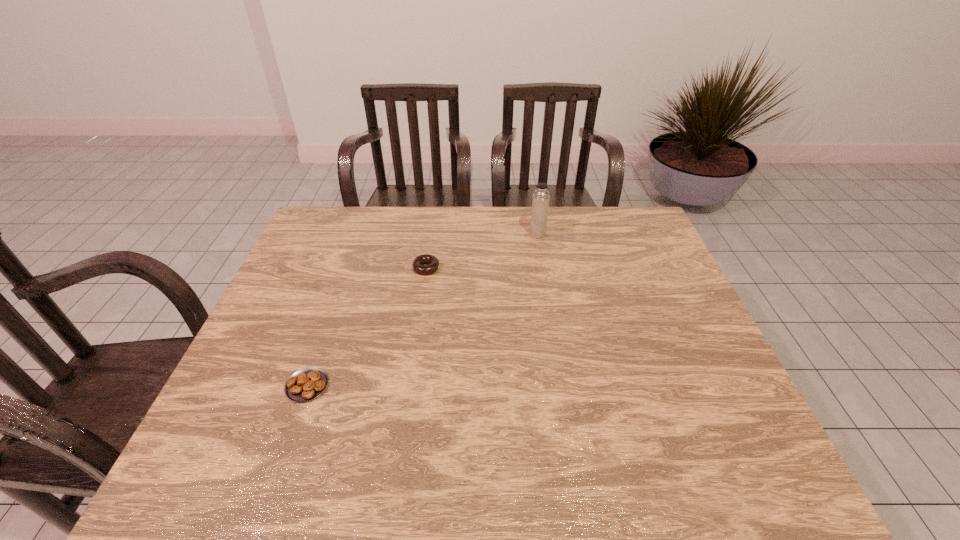
What are the coordinates of `vacant space that is in between the pastry and the second object from left to right` in the screenshot? It's located at (367, 327).

The image size is (960, 540). I want to click on unoccupied area between the rightmost object and the leftmost object, so click(x=422, y=310).

In order to click on vacant point located between the second object from right to left and the thermos bottle in this screenshot , I will do tap(482, 251).

The height and width of the screenshot is (540, 960). I want to click on free spot between the tallest object and the nearest object, so click(x=422, y=310).

This screenshot has height=540, width=960. What are the coordinates of `blank region between the leftmost object and the thermos bottle` in the screenshot? It's located at (422, 310).

Identify which object is the nearest to the thermos bottle. Please provide its 2D coordinates. Your answer should be formatted as a tuple, i.e. [(x, y)], where the tuple contains the x and y coordinates of a point satisfying the conditions above.

[(433, 262)]

You are a GUI agent. You are given a task and a screenshot of the screen. Output one action in this format:
    pyautogui.click(x=<x>, y=<y>)
    Task: Click on the closest object to the second nearest object
    The width and height of the screenshot is (960, 540).
    Given the screenshot: What is the action you would take?
    pyautogui.click(x=540, y=204)

Where is `blank area in the image that satisfies the following two spatial constraints: 1. on the back side of the doughnut; 2. on the right side of the leftmost object`? blank area in the image that satisfies the following two spatial constraints: 1. on the back side of the doughnut; 2. on the right side of the leftmost object is located at coordinates (348, 268).

Where is `free location that satisfies the following two spatial constraints: 1. on the back side of the nearest object; 2. on the right side of the thermos bottle`? The height and width of the screenshot is (540, 960). free location that satisfies the following two spatial constraints: 1. on the back side of the nearest object; 2. on the right side of the thermos bottle is located at coordinates (360, 234).

Where is `free space that satisfies the following two spatial constraints: 1. on the back side of the doughnut; 2. on the right side of the thermos bottle`? free space that satisfies the following two spatial constraints: 1. on the back side of the doughnut; 2. on the right side of the thermos bottle is located at coordinates (431, 234).